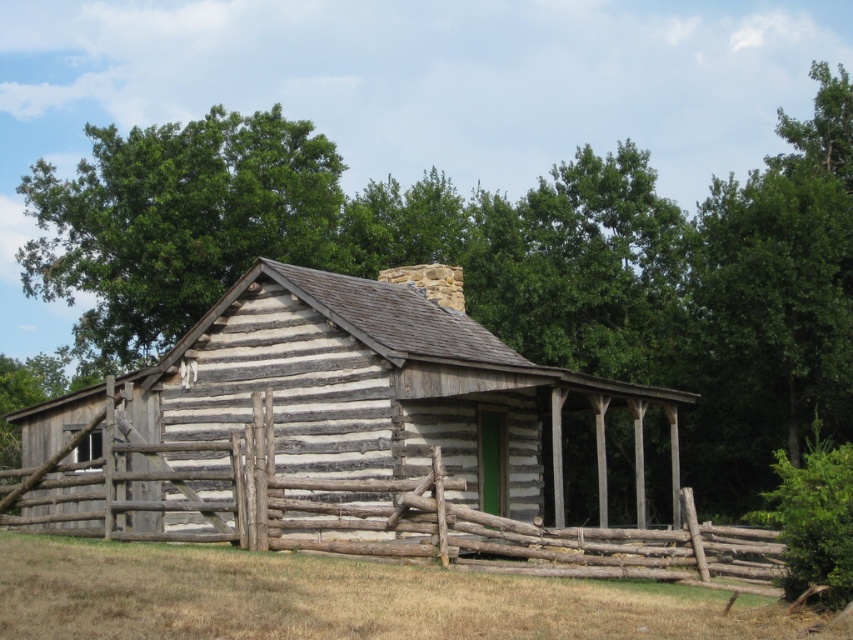
Does point (718, 401) lie in front of point (457, 628)?

No, (718, 401) is behind (457, 628).

Describe the element at coordinates (496, 262) in the screenshot. The image size is (853, 640). I see `green leafy tree at upper center` at that location.

Does point (202, 161) come behind point (422, 573)?

Yes.

The width and height of the screenshot is (853, 640). In order to click on green leafy tree at upper center in this screenshot , I will do `click(496, 262)`.

This screenshot has width=853, height=640. What do you see at coordinates (318, 426) in the screenshot?
I see `weathered wood cabin at center` at bounding box center [318, 426].

Can you confirm if weathered wood cabin at center is positioned to the right of brown wooden fence at lower center?

Yes, weathered wood cabin at center is to the right of brown wooden fence at lower center.

Which is behind, point (479, 339) or point (193, 602)?

The point (479, 339) is behind.

Find the location of a particular element. weathered wood cabin at center is located at coordinates (318, 426).

Does weathered wood fence at lower center have a greater width compared to brown wooden fence at lower center?

Indeed, weathered wood fence at lower center has a greater width compared to brown wooden fence at lower center.

At what (x,y) coordinates should I click in order to perform the action: click on weathered wood fence at lower center. Please return your answer as a coordinate pair (x, y). This screenshot has height=640, width=853. Looking at the image, I should click on (347, 508).

Where is `weathered wood fence at lower center`? weathered wood fence at lower center is located at coordinates (347, 508).